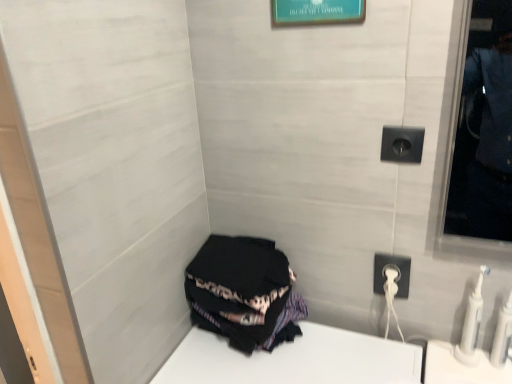
Question: Does teal glossy picture frame at upper center have a greater height compared to white plastic power outlet at lower right?

Choices:
 (A) yes
 (B) no

Answer: (B)

Question: Is teal glossy picture frame at upper center facing away from white plastic power outlet at lower right?

Choices:
 (A) no
 (B) yes

Answer: (A)

Question: Is the depth of teal glossy picture frame at upper center greater than that of white plastic power outlet at lower right?

Choices:
 (A) yes
 (B) no

Answer: (B)

Question: Is teal glossy picture frame at upper center not close to white plastic power outlet at lower right?

Choices:
 (A) yes
 (B) no

Answer: (B)

Question: Is teal glossy picture frame at upper center thinner than white plastic power outlet at lower right?

Choices:
 (A) yes
 (B) no

Answer: (A)

Question: Is black plastic outlet at upper right situated inside white plastic toothbrush at lower right, acting as the second toiletry starting from the right, or outside?

Choices:
 (A) inside
 (B) outside

Answer: (B)

Question: From the image's perspective, is black plastic outlet at upper right positioned above or below white plastic toothbrush at lower right, acting as the second toiletry starting from the right?

Choices:
 (A) below
 (B) above

Answer: (B)

Question: From their relative heights in the image, would you say black plastic outlet at upper right is taller or shorter than white plastic toothbrush at lower right, acting as the second toiletry starting from the right?

Choices:
 (A) short
 (B) tall

Answer: (A)

Question: In terms of width, does black plastic outlet at upper right look wider or thinner when compared to white plastic toothbrush at lower right, acting as the second toiletry starting from the right?

Choices:
 (A) thin
 (B) wide

Answer: (A)

Question: Considering the positions of white plastic power outlet at lower right and black fabric at lower left in the image, is white plastic power outlet at lower right bigger or smaller than black fabric at lower left?

Choices:
 (A) big
 (B) small

Answer: (B)

Question: Would you say white plastic power outlet at lower right is to the left or to the right of black fabric at lower left in the picture?

Choices:
 (A) right
 (B) left

Answer: (A)

Question: Relative to black fabric at lower left, is white plastic power outlet at lower right in front or behind?

Choices:
 (A) front
 (B) behind

Answer: (B)

Question: Considering the positions of white plastic power outlet at lower right and black fabric at lower left in the image, is white plastic power outlet at lower right taller or shorter than black fabric at lower left?

Choices:
 (A) short
 (B) tall

Answer: (A)

Question: From the image's perspective, is teal glossy picture frame at upper center located above or below white plastic toothbrush at lower right, which is counted as the 1th toiletry, starting from the left?

Choices:
 (A) above
 (B) below

Answer: (A)

Question: Is point click(x=281, y=11) positioned closer to the camera than point click(x=462, y=347)?

Choices:
 (A) farther
 (B) closer

Answer: (B)